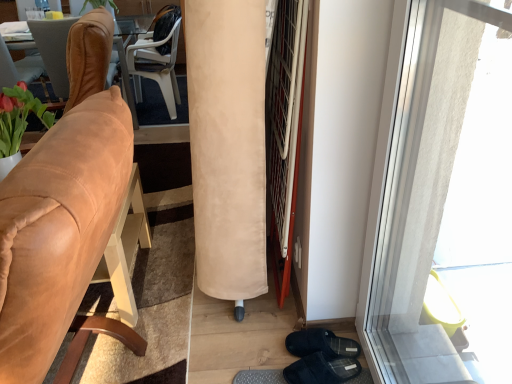
Question: Is white plastic chair at upper center, which is the 3th chair from front to back, next to brown leather chair at left, the second chair positioned from the back, and touching it?

Choices:
 (A) yes
 (B) no

Answer: (B)

Question: Does white plastic chair at upper center, which is the first chair in back-to-front order, appear on the right side of brown leather chair at left, the second chair positioned from the back?

Choices:
 (A) yes
 (B) no

Answer: (A)

Question: From the image's perspective, is white plastic chair at upper center, which is the first chair in back-to-front order, beneath brown leather chair at left, the second chair positioned from the back?

Choices:
 (A) no
 (B) yes

Answer: (A)

Question: Considering the relative sizes of white plastic chair at upper center, which is the first chair in back-to-front order, and brown leather chair at left, positioned as the second chair in front-to-back order, in the image provided, is white plastic chair at upper center, which is the first chair in back-to-front order, smaller than brown leather chair at left, positioned as the second chair in front-to-back order,?

Choices:
 (A) no
 (B) yes

Answer: (B)

Question: From a real-world perspective, is white plastic chair at upper center, which is the first chair in back-to-front order, below brown leather chair at left, the second chair positioned from the back?

Choices:
 (A) yes
 (B) no

Answer: (A)

Question: Is white plastic chair at upper center, which is the 3th chair from front to back, behind brown leather chair at left, the second chair positioned from the back?

Choices:
 (A) no
 (B) yes

Answer: (B)

Question: Is brown leather chair at left, positioned as the second chair in front-to-back order, thinner than transparent glass window at right?

Choices:
 (A) yes
 (B) no

Answer: (B)

Question: Is transparent glass window at right at the back of brown leather chair at left, positioned as the second chair in front-to-back order?

Choices:
 (A) no
 (B) yes

Answer: (A)

Question: Can we say brown leather chair at left, positioned as the second chair in front-to-back order, lies outside transparent glass window at right?

Choices:
 (A) no
 (B) yes

Answer: (B)

Question: Are brown leather chair at left, the second chair positioned from the back, and transparent glass window at right located far from each other?

Choices:
 (A) no
 (B) yes

Answer: (B)

Question: Can you confirm if brown leather chair at left, the second chair positioned from the back, is bigger than transparent glass window at right?

Choices:
 (A) yes
 (B) no

Answer: (A)

Question: Does brown leather chair at left, the second chair positioned from the back, appear on the left side of transparent glass window at right?

Choices:
 (A) no
 (B) yes

Answer: (B)

Question: Does suede tan chair at left, which is the first chair from front to back, have a greater height compared to brown leather chair at left, the second chair positioned from the back?

Choices:
 (A) no
 (B) yes

Answer: (B)